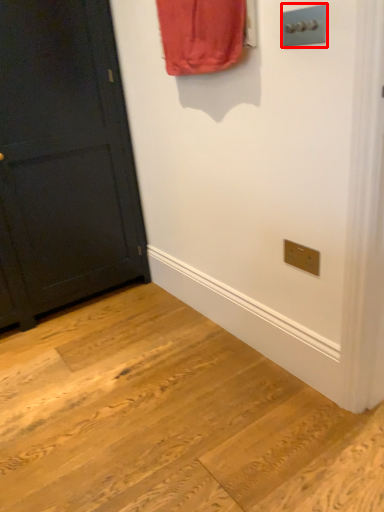
Question: From the image's perspective, where is light switch (annotated by the red box) located in relation to door in the image?

Choices:
 (A) below
 (B) above

Answer: (B)